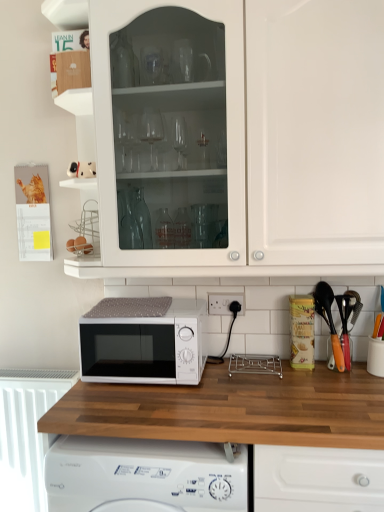
I want to click on free space above white matte microwave at center (from a real-world perspective), so click(x=147, y=306).